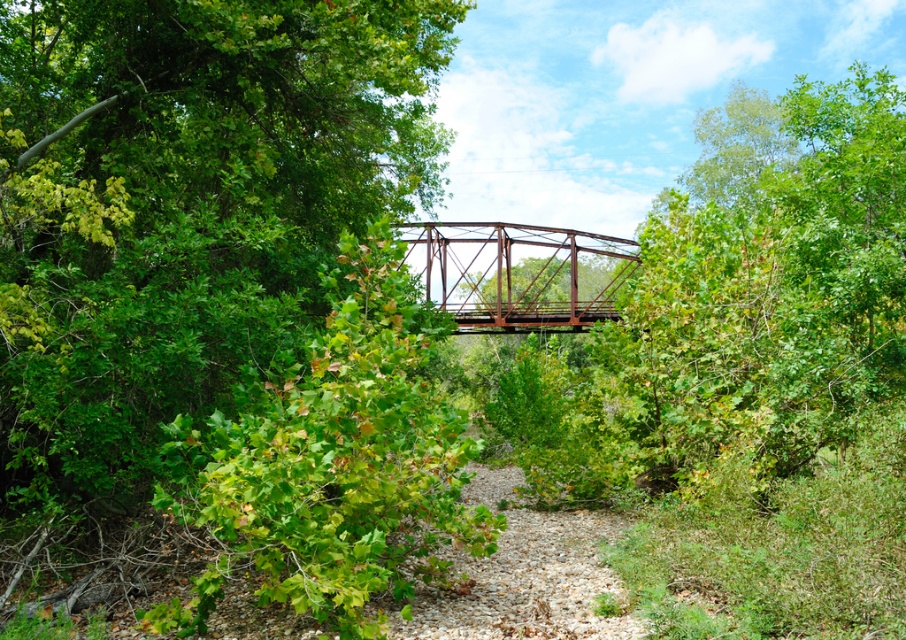
You are standing on the gravel path and want to take a photo of the rusty metal bridge at center without the green leafy tree at upper left blocking the view. Which direction should you move to ensure the tree is out of frame?

Move to the right side of the gravel path so the green leafy tree at upper left is no longer blocking the view of the rusty metal bridge at center.

You are a hiker planning to cross the rusty metal bridge at center. There is a green leafy tree at upper left blocking your view. Can you see the bridge clearly from where you are standing?

The green leafy tree at upper left is positioned on the left side of the rusty metal bridge at center, so it might block your view of the bridge depending on your exact position. However, since the tree is to the left of the bridge, moving slightly to the right could help you see the bridge more clearly.

You are a hiker planning to cross the rusty metal bridge at center. You notice a green leafy tree at upper left in the distance. Which object is wider from your current viewpoint?

The green leafy tree at upper left is wider than the rusty metal bridge at center based on their visual width in the scene.